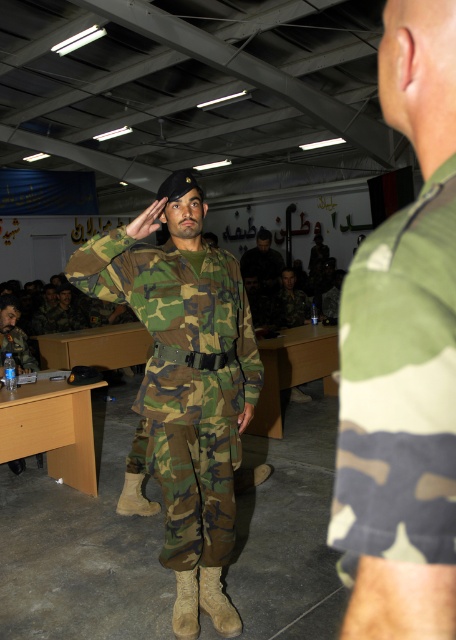
Describe the element at coordinates (184, 381) in the screenshot. I see `camo fabric uniform at center` at that location.

Is camo fabric uniform at center wider than matte camouflage uniform at center?

Correct, the width of camo fabric uniform at center exceeds that of matte camouflage uniform at center.

This screenshot has width=456, height=640. Describe the element at coordinates (184, 381) in the screenshot. I see `camo fabric uniform at center` at that location.

Locate an element on the screen. The height and width of the screenshot is (640, 456). camo fabric uniform at center is located at coordinates (184, 381).

Does camo fabric uniform at right appear on the left side of matte camouflage uniform at center?

Incorrect, camo fabric uniform at right is not on the left side of matte camouflage uniform at center.

The width and height of the screenshot is (456, 640). I want to click on camo fabric uniform at right, so [399, 388].

Can you confirm if camo fabric uniform at right is positioned to the right of camo fabric uniform at center?

Correct, you'll find camo fabric uniform at right to the right of camo fabric uniform at center.

Is point (350, 500) positioned after point (171, 314)?

That is False.

Where is `camo fabric uniform at right`? The image size is (456, 640). camo fabric uniform at right is located at coordinates (399, 388).